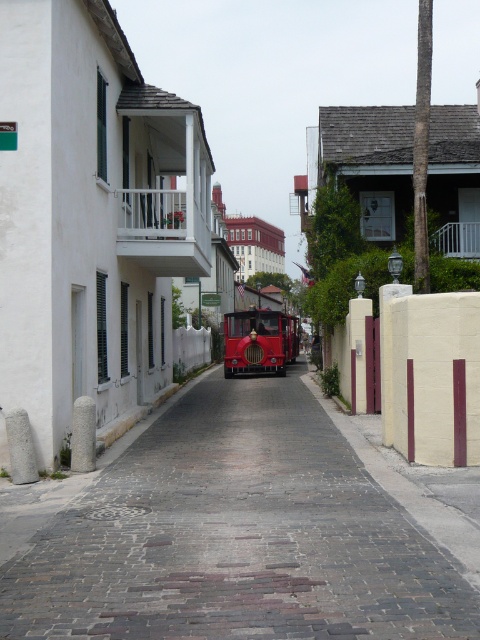
Consider the image. You are a delivery person trying to park your bike in the smooth cobblestone alley at center and the shiny red trolley at center. Which object is positioned to the left side of the other?

The smooth cobblestone alley at center is to the left of the shiny red trolley at center.

You are a delivery person with a cart that is 2 meters long. You need to move your cart through the smooth cobblestone alley at center and around the shiny red trolley at center. Can your cart fit through the space between them?

The smooth cobblestone alley at center and shiny red trolley at center are 17.95 meters apart, so yes, the cart can fit through the space between them since the distance is much larger than the cart length of 2 meters.

You are a tourist standing at the entrance of the smooth cobblestone alley at center and want to take a photo of the shiny red trolley at center without any obstructions. Is there anything blocking your view of the trolley?

The smooth cobblestone alley at center is in front of the shiny red trolley at center, so the alley itself may block your view of the trolley. You might need to move to a different angle or position to capture the trolley without obstruction.